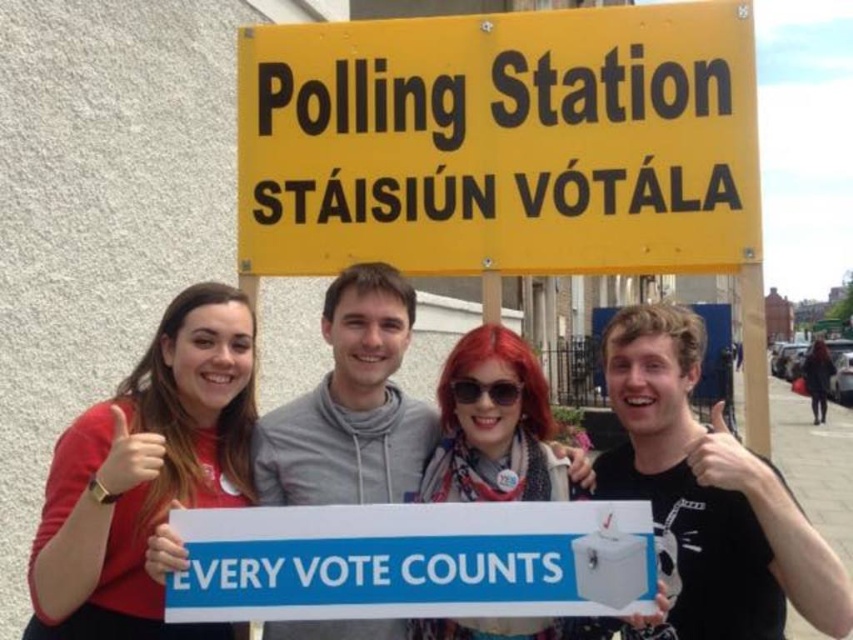
You are a photographer trying to capture a photo of the yellow plastic sign at upper center and the matte red shirt at left. Which object should you focus on first if you want to ensure both are in focus without adjusting the camera settings?

The yellow plastic sign at upper center is wider than the matte red shirt at left, so focusing on the wider object first would help ensure both are in focus.

You are a photographer taking a picture of the matte red shirt at left and the black matte sign at upper center. Which object should you zoom in on to capture more details of its surface features?

The matte red shirt at left has a smaller width than the black matte sign at upper center, so you should zoom in on the matte red shirt at left to capture more details of its surface features since it is smaller and requires closer focus.

You are a photographer taking a picture of the matte red shirt at left and the black matte sign at upper center. Which object should you focus on first if you want to ensure both are in focus, considering their heights?

The matte red shirt at left is shorter than the black matte sign at upper center, so you should focus on the black matte sign at upper center first to ensure both are in focus.